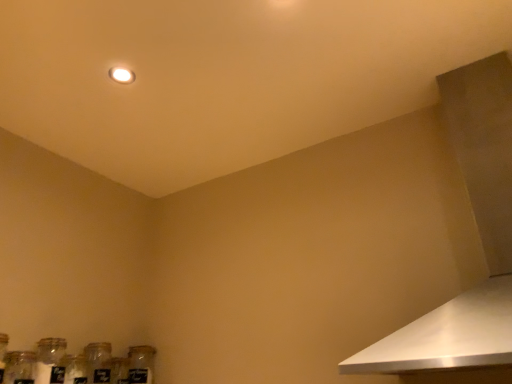
Question: Is point pos(14,365) closer or farther from the camera than point pos(490,360)?

Choices:
 (A) closer
 (B) farther

Answer: (B)

Question: Do you think clear glass jar at lower left is within white metallic vent at upper right, or outside of it?

Choices:
 (A) outside
 (B) inside

Answer: (A)

Question: Based on their relative distances, which object is nearer to the clear glass jar at lower left?

Choices:
 (A) white metallic vent at upper right
 (B) clear glass jar at lower left, which is counted as the 1th bottle, starting from the right
 (C) clear glass jar at lower left, which ranks as the 1th bottle in left-to-right order
 (D) clear glass jar at lower left

Answer: (C)

Question: Which object is the closest to the clear glass jar at lower left?

Choices:
 (A) clear glass jar at lower left, which is the second bottle from right to left
 (B) clear glass jar at lower left, the second bottle from the left
 (C) white metallic vent at upper right
 (D) clear glass jar at lower left

Answer: (B)